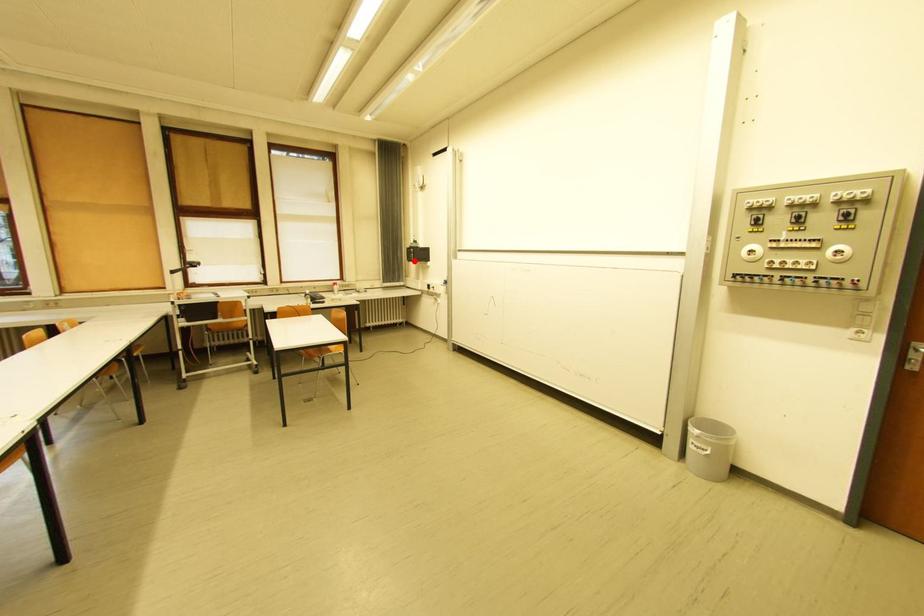
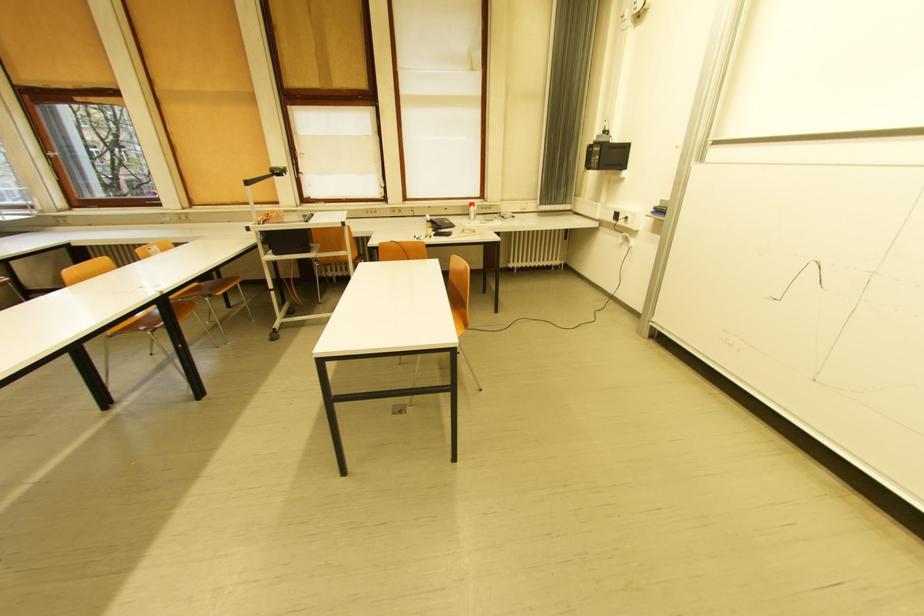
Question: I am providing you with two images of the same scene from different viewpoints. In image1, a red point is highlighted. Considering the same 3D point in image2, which of the following is correct?

Choices:
 (A) It is closer
 (B) It is farther

Answer: (A)